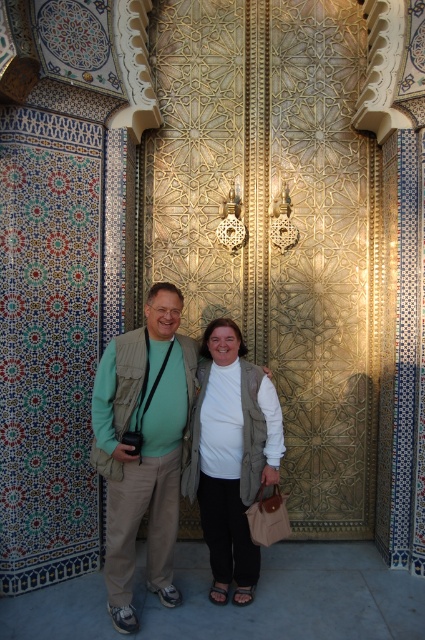
What do you see at coordinates (144, 445) in the screenshot? I see `green fabric vest at center` at bounding box center [144, 445].

Who is more distant from viewer, (x=192, y=362) or (x=254, y=561)?

Positioned behind is point (x=192, y=362).

The image size is (425, 640). Identify the location of green fabric vest at center. (144, 445).

Locate an element on the screen. The width and height of the screenshot is (425, 640). green fabric vest at center is located at coordinates (144, 445).